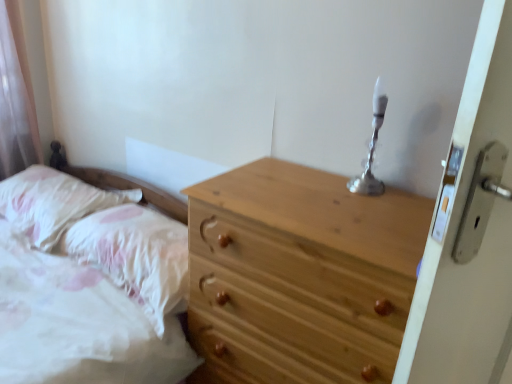
The image size is (512, 384). I want to click on silver metallic candle holder at upper right, so click(372, 147).

Measure the distance between fluffy white pillow at left, which ranks as the second pillow in right-to-left order, and camera.

fluffy white pillow at left, which ranks as the second pillow in right-to-left order, is 1.67 meters away from camera.

This screenshot has height=384, width=512. What are the coordinates of `natural wood chest of drawers at center` in the screenshot? It's located at (298, 275).

Where is `silver metallic candle holder at upper right`? silver metallic candle holder at upper right is located at coordinates (372, 147).

From the image's perspective, is natural wood chest of drawers at center on fluffy white pillow at left, the first pillow from the left?

No, from the image's perspective, natural wood chest of drawers at center is not above fluffy white pillow at left, the first pillow from the left.

Is natural wood chest of drawers at center behind fluffy white pillow at left, the first pillow from the left?

No.

Considering the relative sizes of natural wood chest of drawers at center and fluffy white pillow at left, which ranks as the second pillow in right-to-left order, in the image provided, is natural wood chest of drawers at center thinner than fluffy white pillow at left, which ranks as the second pillow in right-to-left order,?

No, natural wood chest of drawers at center is not thinner than fluffy white pillow at left, which ranks as the second pillow in right-to-left order.

Consider the image. Which object is more forward, natural wood chest of drawers at center or white fluffy pillow at lower left, the 1th pillow positioned from the right?

natural wood chest of drawers at center is in front.

Can you confirm if natural wood chest of drawers at center is positioned to the right of white fluffy pillow at lower left, arranged as the 2th pillow when viewed from the left?

Yes, natural wood chest of drawers at center is to the right of white fluffy pillow at lower left, arranged as the 2th pillow when viewed from the left.

Is natural wood chest of drawers at center positioned with its back to white fluffy pillow at lower left, the 1th pillow positioned from the right?

That's not correct — natural wood chest of drawers at center is not looking away from white fluffy pillow at lower left, the 1th pillow positioned from the right.

Which of these two, silver metallic candle holder at upper right or white fluffy pillow at lower left, the 1th pillow positioned from the right, is smaller?

With smaller size is silver metallic candle holder at upper right.

Between point (352, 184) and point (93, 225), which one is positioned in front?

Positioned in front is point (352, 184).

How many degrees apart are the facing directions of silver metallic candle holder at upper right and white fluffy pillow at lower left, the 1th pillow positioned from the right?

4.57 degrees.

Consider the image. Is silver metallic candle holder at upper right taller or shorter than white fluffy pillow at lower left, arranged as the 2th pillow when viewed from the left?

silver metallic candle holder at upper right is taller than white fluffy pillow at lower left, arranged as the 2th pillow when viewed from the left.

Considering the relative sizes of silver metallic candle holder at upper right and natural wood chest of drawers at center in the image provided, is silver metallic candle holder at upper right bigger than natural wood chest of drawers at center?

Incorrect, silver metallic candle holder at upper right is not larger than natural wood chest of drawers at center.

Which object is further away from the camera taking this photo, silver metallic candle holder at upper right or natural wood chest of drawers at center?

silver metallic candle holder at upper right is more distant.

Is silver metallic candle holder at upper right thinner than natural wood chest of drawers at center?

Yes, silver metallic candle holder at upper right is thinner than natural wood chest of drawers at center.

Who is bigger, white fluffy pillow at lower left, the 1th pillow positioned from the right, or fluffy white pillow at left, which ranks as the second pillow in right-to-left order?

With larger size is white fluffy pillow at lower left, the 1th pillow positioned from the right.

Does white fluffy pillow at lower left, the 1th pillow positioned from the right, appear on the left side of fluffy white pillow at left, the first pillow from the left?

In fact, white fluffy pillow at lower left, the 1th pillow positioned from the right, is to the right of fluffy white pillow at left, the first pillow from the left.

Is white fluffy pillow at lower left, the 1th pillow positioned from the right, closer to camera compared to fluffy white pillow at left, the first pillow from the left?

That is True.

Could you tell me if white fluffy pillow at lower left, arranged as the 2th pillow when viewed from the left, is turned towards fluffy white pillow at left, the first pillow from the left?

No, white fluffy pillow at lower left, arranged as the 2th pillow when viewed from the left, does not turn towards fluffy white pillow at left, the first pillow from the left.

I want to click on pillow that is the 2nd object to the left of the silver metallic candle holder at upper right, starting at the anchor, so click(53, 203).

Is silver metallic candle holder at upper right in front of fluffy white pillow at left, which ranks as the second pillow in right-to-left order?

Yes, silver metallic candle holder at upper right is closer to the camera.

Is silver metallic candle holder at upper right wider or thinner than fluffy white pillow at left, the first pillow from the left?

In the image, silver metallic candle holder at upper right appears to be more narrow than fluffy white pillow at left, the first pillow from the left.

Does silver metallic candle holder at upper right have a smaller size compared to fluffy white pillow at left, the first pillow from the left?

Indeed, silver metallic candle holder at upper right has a smaller size compared to fluffy white pillow at left, the first pillow from the left.

Is white fluffy pillow at lower left, arranged as the 2th pillow when viewed from the left, aimed at silver metallic candle holder at upper right?

No, white fluffy pillow at lower left, arranged as the 2th pillow when viewed from the left, is not oriented towards silver metallic candle holder at upper right.

Identify the location of candle holder lying above the white fluffy pillow at lower left, the 1th pillow positioned from the right (from the image's perspective). The height and width of the screenshot is (384, 512). (372, 147).

From a real-world perspective, which is physically above, white fluffy pillow at lower left, the 1th pillow positioned from the right, or silver metallic candle holder at upper right?

silver metallic candle holder at upper right is physically above.

Which of these two, white fluffy pillow at lower left, arranged as the 2th pillow when viewed from the left, or silver metallic candle holder at upper right, is thinner?

Thinner between the two is silver metallic candle holder at upper right.

Where is `chest of drawers on the right of fluffy white pillow at left, the first pillow from the left`? chest of drawers on the right of fluffy white pillow at left, the first pillow from the left is located at coordinates (298, 275).

From the image's perspective, which pillow is the 1st one above the natural wood chest of drawers at center? Please provide its 2D coordinates.

[(136, 256)]

Estimate the real-world distances between objects in this image. Which object is closer to natural wood chest of drawers at center, silver metallic candle holder at upper right or white fluffy pillow at lower left, arranged as the 2th pillow when viewed from the left?

silver metallic candle holder at upper right.

When comparing their distances from fluffy white pillow at left, which ranks as the second pillow in right-to-left order, does silver metallic candle holder at upper right or white fluffy pillow at lower left, the 1th pillow positioned from the right, seem closer?

white fluffy pillow at lower left, the 1th pillow positioned from the right, lies closer to fluffy white pillow at left, which ranks as the second pillow in right-to-left order, than the other object.

From the image, which object appears to be nearer to silver metallic candle holder at upper right, natural wood chest of drawers at center or fluffy white pillow at left, the first pillow from the left?

natural wood chest of drawers at center is positioned closer to the anchor silver metallic candle holder at upper right.

Which object lies further to the anchor point fluffy white pillow at left, which ranks as the second pillow in right-to-left order, natural wood chest of drawers at center or white fluffy pillow at lower left, arranged as the 2th pillow when viewed from the left?

Among the two, natural wood chest of drawers at center is located further to fluffy white pillow at left, which ranks as the second pillow in right-to-left order.

Considering their positions, is white fluffy pillow at lower left, the 1th pillow positioned from the right, positioned further to fluffy white pillow at left, the first pillow from the left, than natural wood chest of drawers at center?

natural wood chest of drawers at center is positioned further to the anchor fluffy white pillow at left, the first pillow from the left.

Based on their spatial positions, is natural wood chest of drawers at center or silver metallic candle holder at upper right further from fluffy white pillow at left, the first pillow from the left?

The object further to fluffy white pillow at left, the first pillow from the left, is silver metallic candle holder at upper right.

Which object lies nearer to the anchor point white fluffy pillow at lower left, arranged as the 2th pillow when viewed from the left, silver metallic candle holder at upper right or natural wood chest of drawers at center?

The object closer to white fluffy pillow at lower left, arranged as the 2th pillow when viewed from the left, is natural wood chest of drawers at center.

Consider the image. When comparing their distances from natural wood chest of drawers at center, does silver metallic candle holder at upper right or fluffy white pillow at left, the first pillow from the left, seem further?

fluffy white pillow at left, the first pillow from the left, lies further to natural wood chest of drawers at center than the other object.

The image size is (512, 384). I want to click on chest of drawers between fluffy white pillow at left, which ranks as the second pillow in right-to-left order, and silver metallic candle holder at upper right, in the horizontal direction, so click(x=298, y=275).

Where is `pillow situated between fluffy white pillow at left, the first pillow from the left, and silver metallic candle holder at upper right from left to right`? pillow situated between fluffy white pillow at left, the first pillow from the left, and silver metallic candle holder at upper right from left to right is located at coordinates (136, 256).

This screenshot has height=384, width=512. Find the location of `the chest of drawers located between white fluffy pillow at lower left, arranged as the 2th pillow when viewed from the left, and silver metallic candle holder at upper right in the left-right direction`. the chest of drawers located between white fluffy pillow at lower left, arranged as the 2th pillow when viewed from the left, and silver metallic candle holder at upper right in the left-right direction is located at coordinates (298, 275).

You are a GUI agent. You are given a task and a screenshot of the screen. Output one action in this format:
    pyautogui.click(x=<x>, y=<y>)
    Task: Click on the pillow between fluffy white pillow at left, the first pillow from the left, and natural wood chest of drawers at center, in the horizontal direction
    
    Given the screenshot: What is the action you would take?
    pyautogui.click(x=136, y=256)